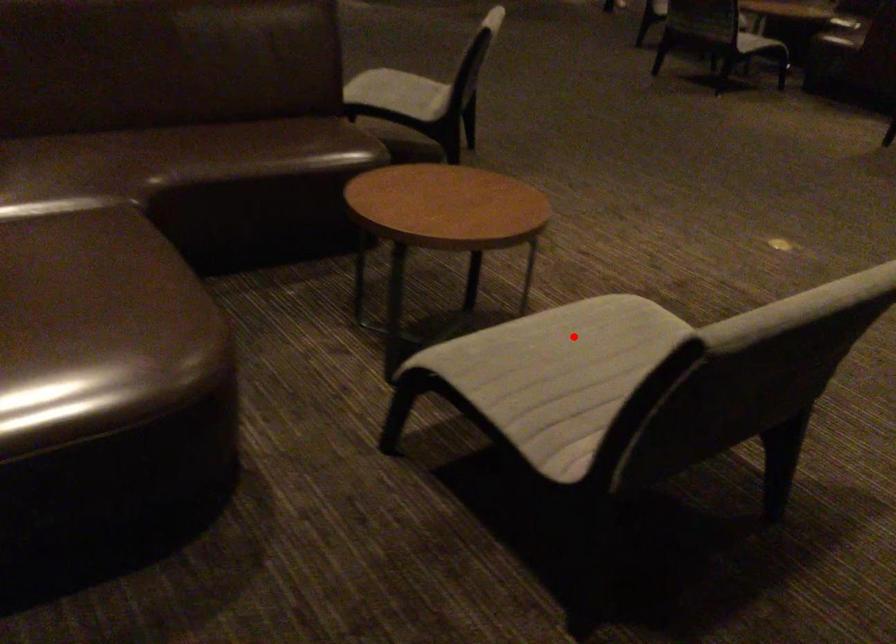
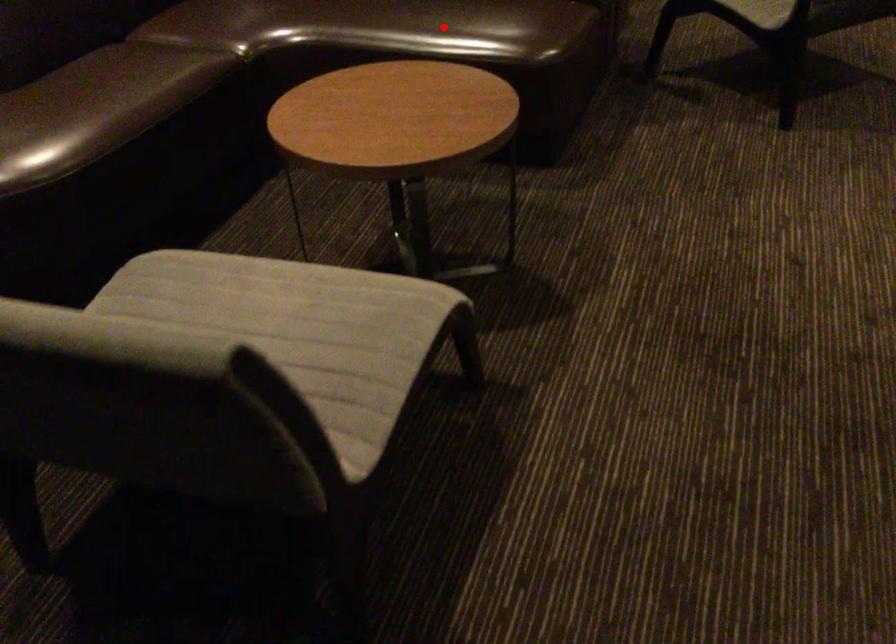
I am providing you with two images of the same scene from different viewpoints. A red point is marked on the first image and another point is marked on the second image. Is the marked point in image1 the same physical position as the marked point in image2?

No